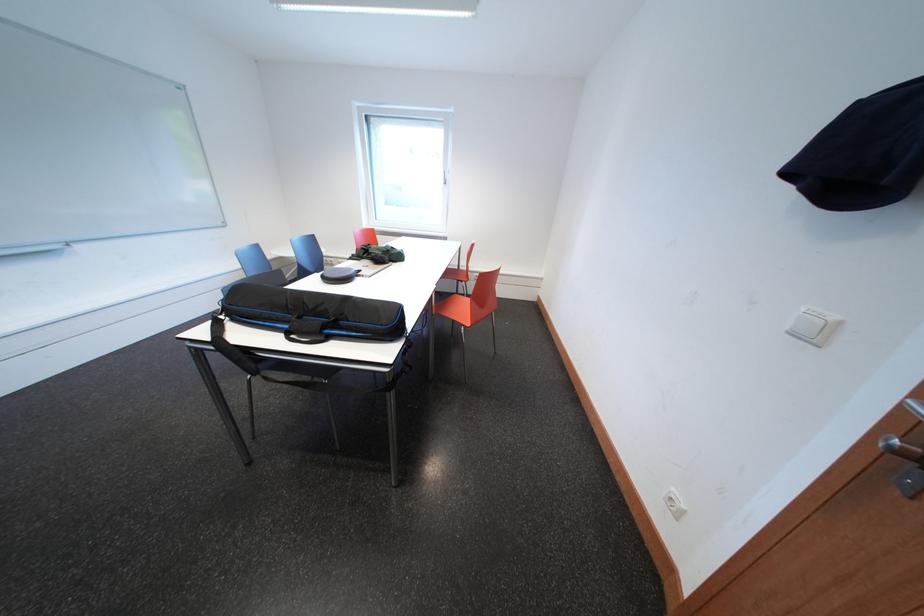
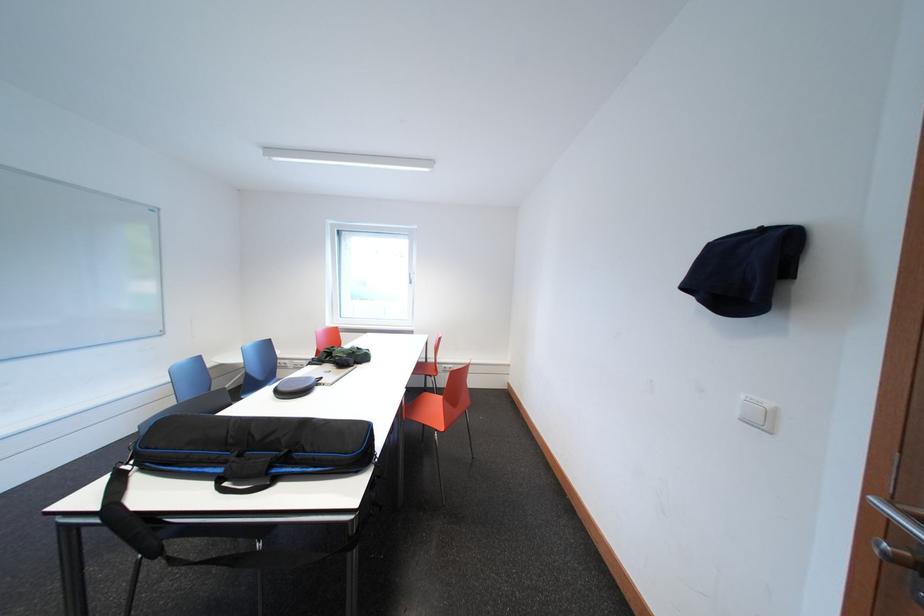
Which direction would the cameraman need to move to produce the second image?

The movement direction of the cameraman is left, backward.